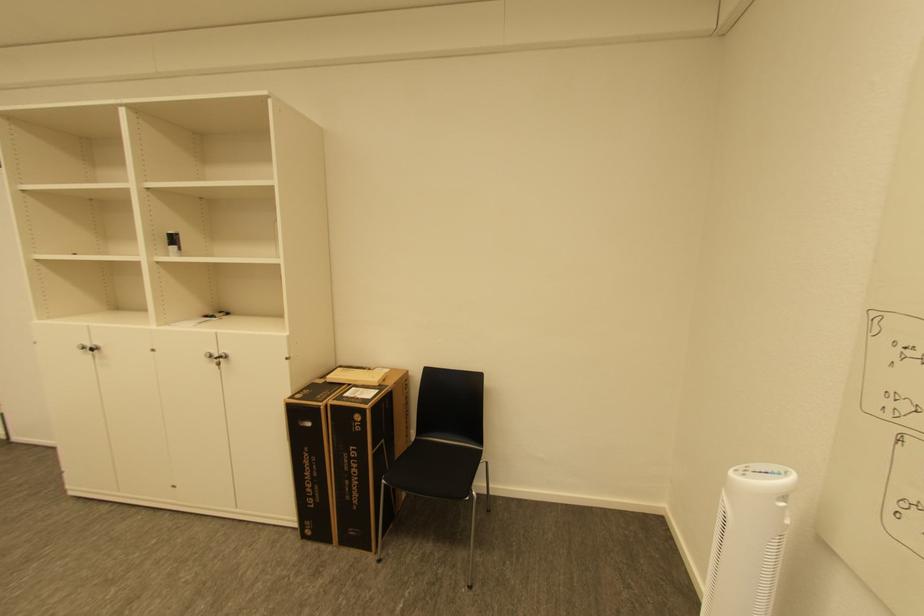
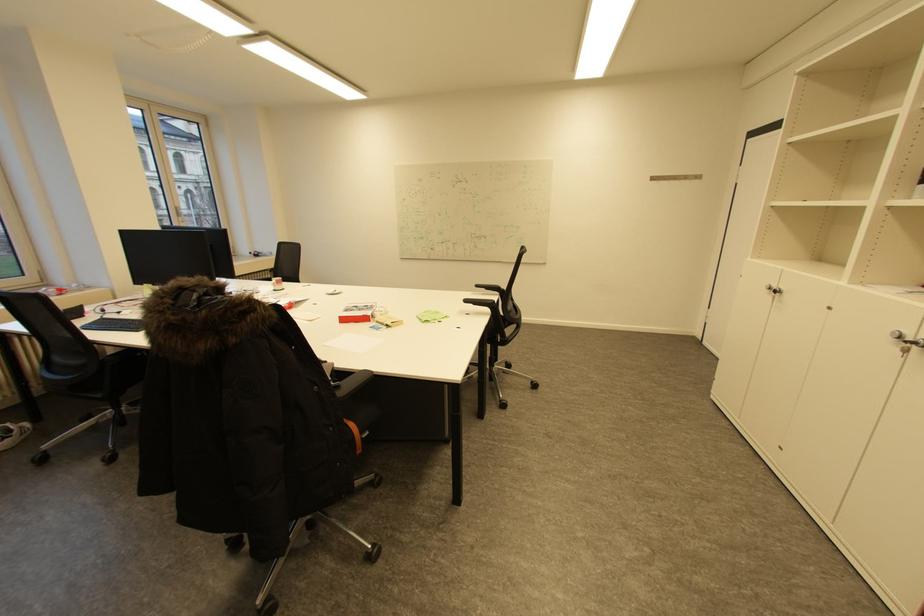
In the scene shown: First-person continuous shooting, in which direction is the camera rotating?

The camera rotated toward left-down.